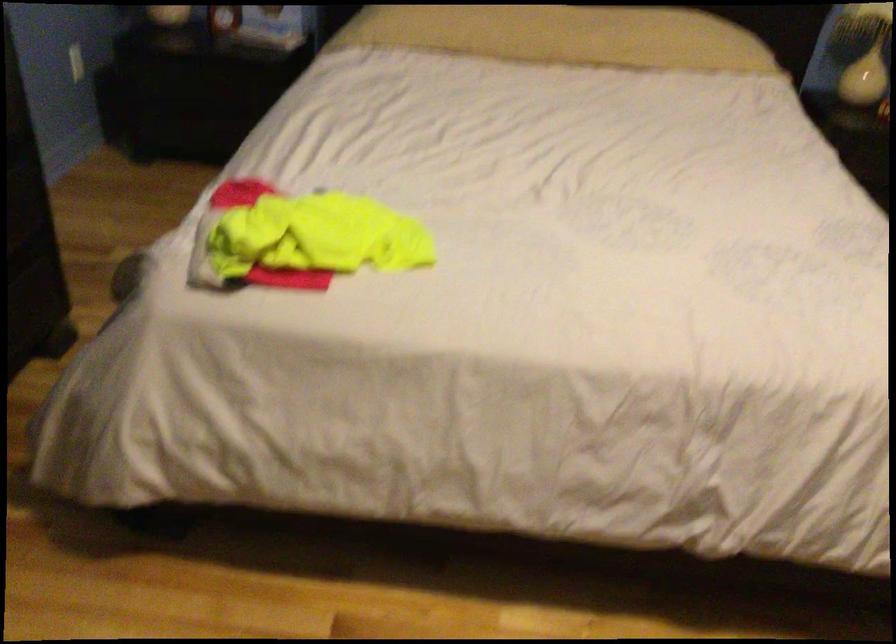
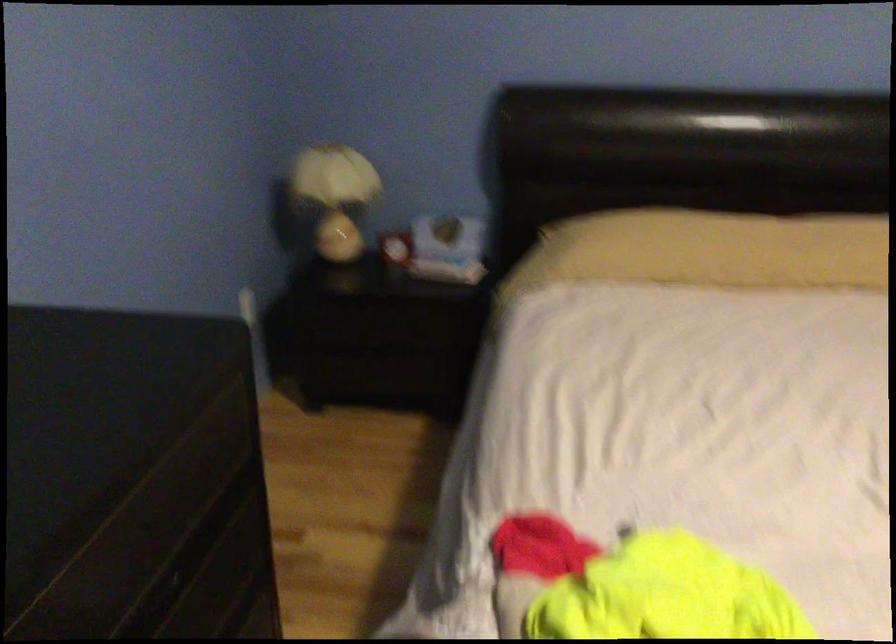
Question: The first image is from the beginning of the video and the second image is from the end. How did the camera likely rotate when shooting the video?

Choices:
 (A) Left
 (B) Right
 (C) Up
 (D) Down

Answer: (C)